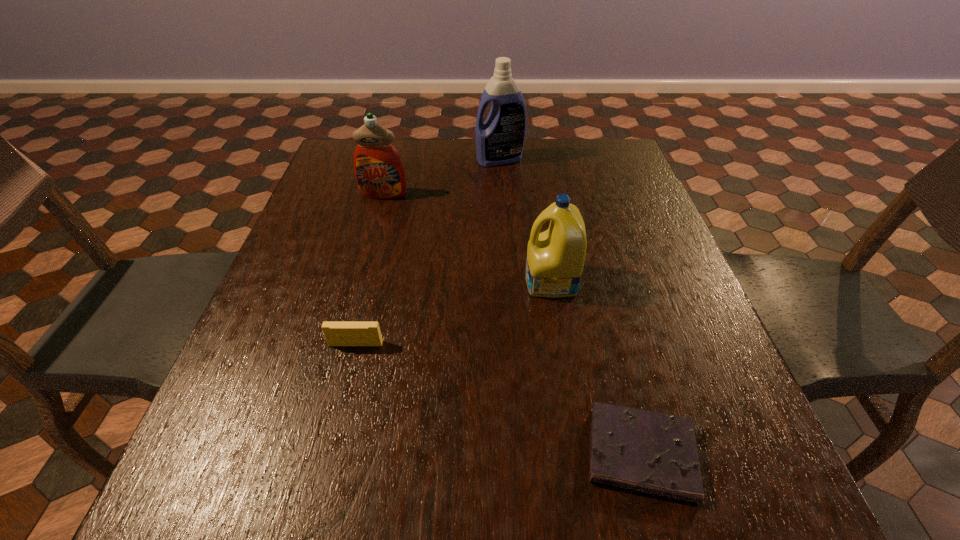
The width and height of the screenshot is (960, 540). Find the location of `the tallest detergent`. the tallest detergent is located at coordinates (500, 140).

The image size is (960, 540). I want to click on the farthest object, so click(x=500, y=140).

At what (x,y) coordinates should I click in order to perform the action: click on the leftmost detergent. Please return your answer as a coordinate pair (x, y). The width and height of the screenshot is (960, 540). Looking at the image, I should click on (379, 171).

What are the coordinates of `the second farthest detergent` in the screenshot? It's located at (379, 171).

I want to click on the third nearest object, so click(555, 258).

Image resolution: width=960 pixels, height=540 pixels. In order to click on videotape in this screenshot , I will do `click(336, 333)`.

In order to click on the fourth farthest object in this screenshot , I will do `click(336, 333)`.

The width and height of the screenshot is (960, 540). Find the location of `the nearest object`. the nearest object is located at coordinates (656, 453).

Where is `the shortest object`? The image size is (960, 540). the shortest object is located at coordinates (656, 453).

Locate an element on the screen. vacant space situated on the right of the tallest detergent is located at coordinates (551, 159).